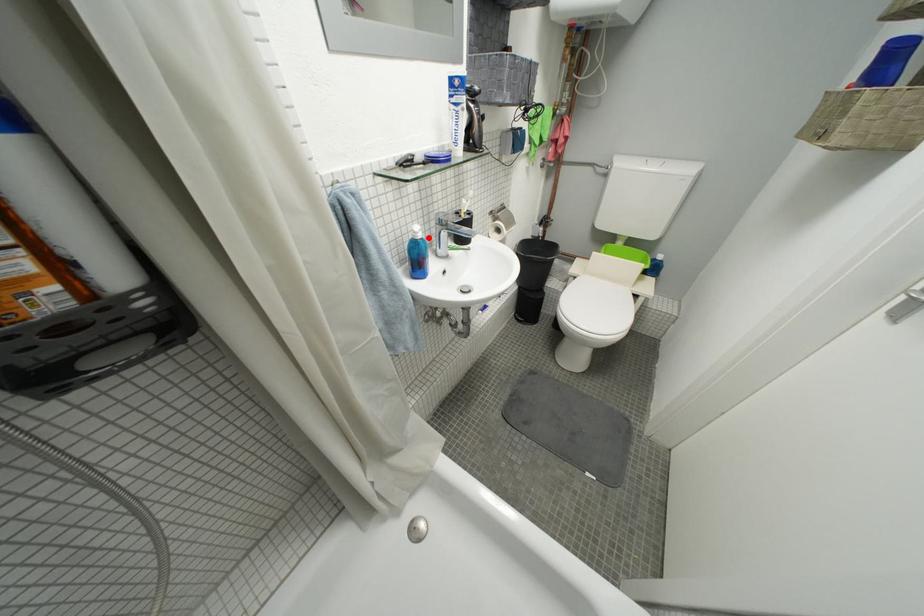
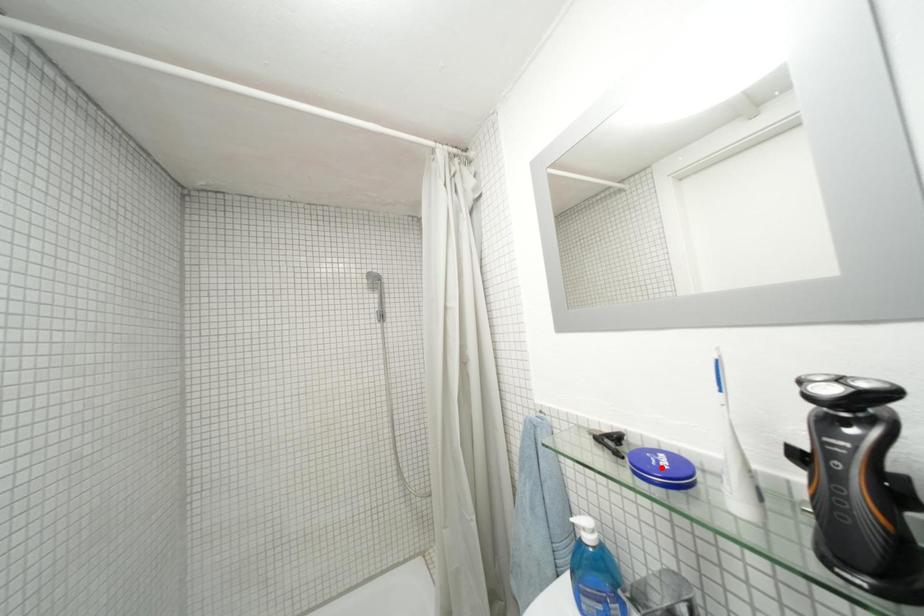
I am providing you with two images of the same scene from different viewpoints. A red point is marked on the first image and another point is marked on the second image. Is the red point in image1 aligned with the point shown in image2?

No